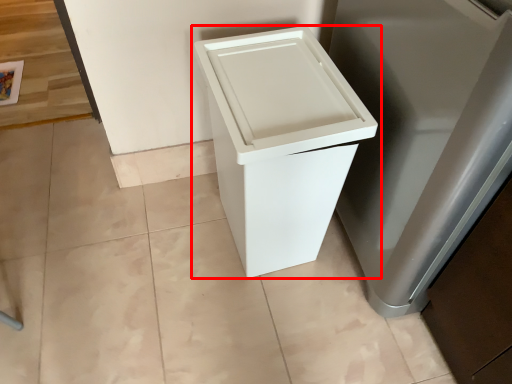
Question: Observing the image, what is the correct spatial positioning of waste container (annotated by the red box) in reference to appliance?

Choices:
 (A) right
 (B) left

Answer: (B)